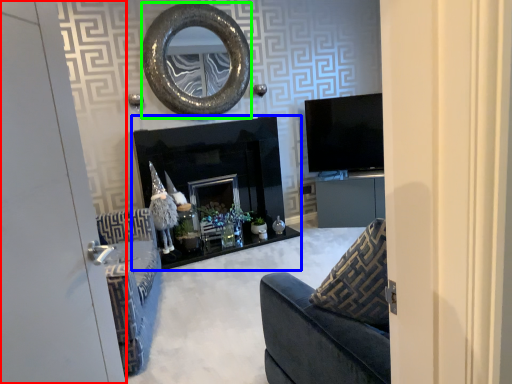
Question: Considering the real-world distances, which object is closest to door (highlighted by a red box)? fireplace (highlighted by a blue box) or oval (highlighted by a green box).

Choices:
 (A) fireplace
 (B) oval

Answer: (A)